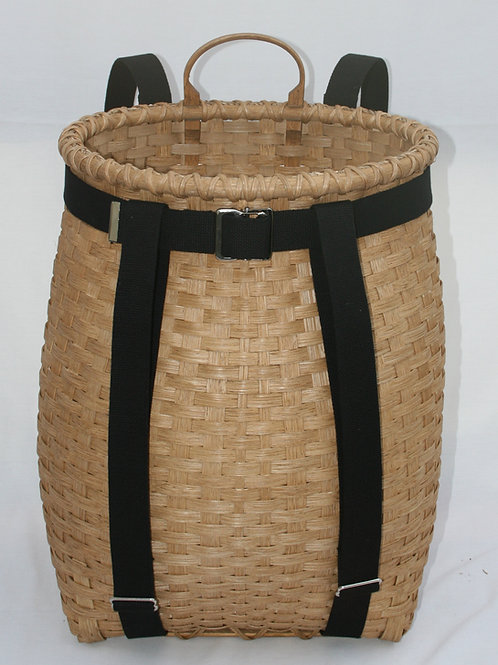
Identify the location of lip of basket. Image resolution: width=498 pixels, height=665 pixels. (251, 181), (245, 104).